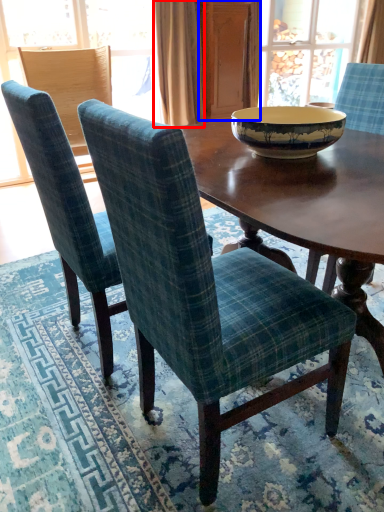
Question: Which object appears closest to the camera in this image, curtain (highlighted by a red box) or screen door (highlighted by a blue box)?

Choices:
 (A) curtain
 (B) screen door

Answer: (A)